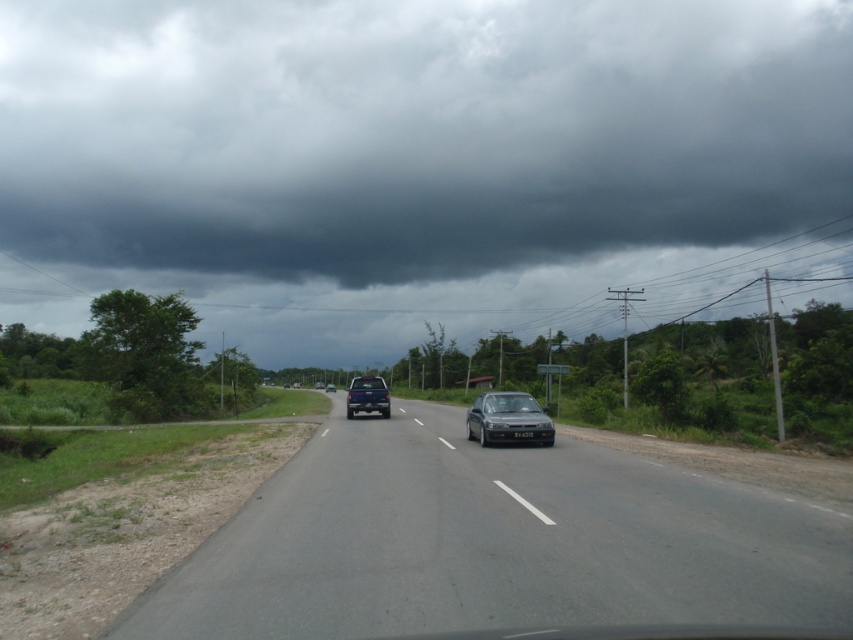
You are driving a car and see two points on the road ahead. The first point is at coordinates point (329, 116) and the second point is at point (346, 412). Which point is closer to your current position?

Point (329, 116) is behind point (346, 412), so the closer point to your current position is point (346, 412).

You are driving a car and see the blue metallic truck at center ahead on the road. There is a dark gray cloud at upper center in the sky. From the driver seat, which object is positioned to the right when looking forward?

The dark gray cloud at upper center is positioned to the right of the blue metallic truck at center.

You are a driver approaching the intersection ahead. You see a metallic blue truck at center and a blue metallic truck at center. Which truck is positioned higher in the image?

The metallic blue truck at center is positioned higher than the blue metallic truck at center in the image.